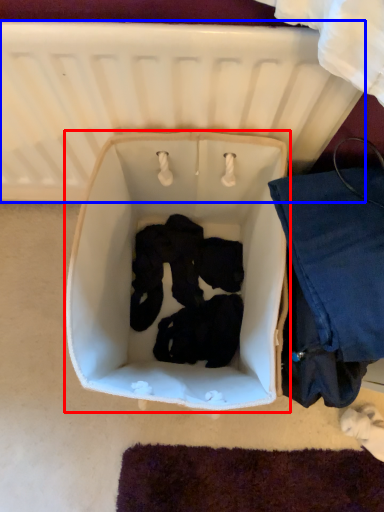
Question: Which point is closer to the camera, baby carriage (highlighted by a red box) or infant bed (highlighted by a blue box)?

Choices:
 (A) baby carriage
 (B) infant bed

Answer: (B)